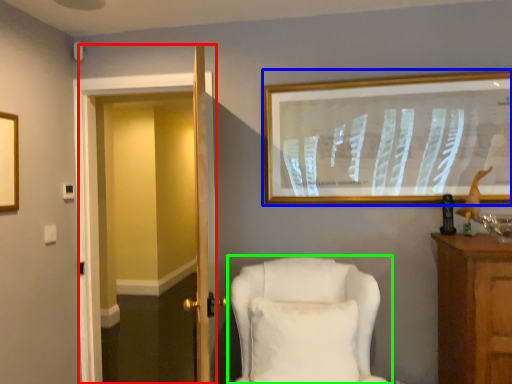
Question: Which object is positioned closest to glass door (highlighted by a red box)? Select from picture frame (highlighted by a blue box) and chair (highlighted by a green box).

Choices:
 (A) picture frame
 (B) chair

Answer: (A)